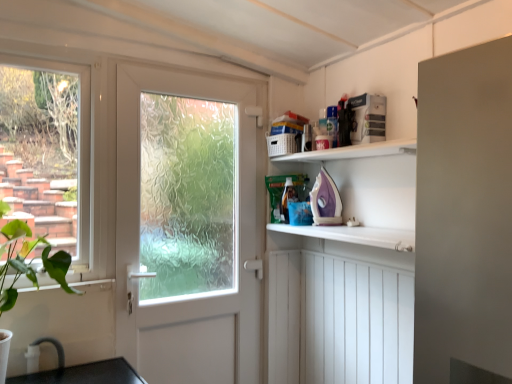
In order to click on free spot above white frosted glass door at center (from a real-world perspective) in this screenshot , I will do `click(192, 71)`.